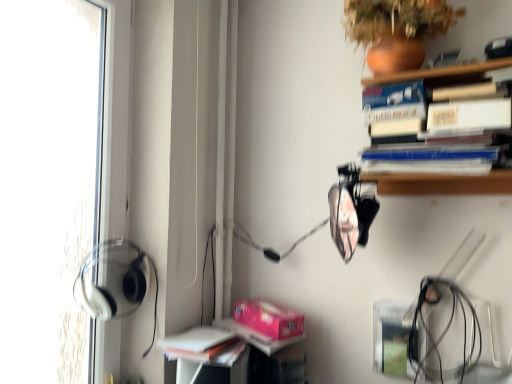
Question: From the image's perspective, relative to white matte book at lower left, is terracotta clay vase at upper right above or below?

Choices:
 (A) above
 (B) below

Answer: (A)

Question: From their relative heights in the image, would you say terracotta clay vase at upper right is taller or shorter than white matte book at lower left?

Choices:
 (A) short
 (B) tall

Answer: (B)

Question: Which of these objects is positioned closest to the white matte book at lower left?

Choices:
 (A) terracotta clay vase at upper right
 (B) pink matte paperback book at lower center

Answer: (B)

Question: Which of these objects is positioned closest to the pink matte paperback book at lower center?

Choices:
 (A) terracotta clay vase at upper right
 (B) white matte book at lower left

Answer: (B)